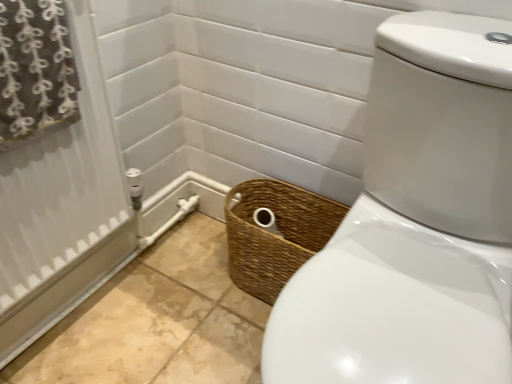
Question: Do you think woven brown basket at lower center is within brown textured fabric at upper left, or outside of it?

Choices:
 (A) inside
 (B) outside

Answer: (B)

Question: Is woven brown basket at lower center in front of or behind brown textured fabric at upper left in the image?

Choices:
 (A) behind
 (B) front

Answer: (A)

Question: Is woven brown basket at lower center wider or thinner than brown textured fabric at upper left?

Choices:
 (A) wide
 (B) thin

Answer: (A)

Question: Considering the positions of point (17, 34) and point (300, 228), is point (17, 34) closer or farther from the camera than point (300, 228)?

Choices:
 (A) closer
 (B) farther

Answer: (A)

Question: In terms of size, does brown textured fabric at upper left appear bigger or smaller than woven brown basket at lower center?

Choices:
 (A) small
 (B) big

Answer: (A)

Question: Relative to woven brown basket at lower center, is brown textured fabric at upper left in front or behind?

Choices:
 (A) front
 (B) behind

Answer: (A)

Question: Is brown textured fabric at upper left inside or outside of woven brown basket at lower center?

Choices:
 (A) outside
 (B) inside

Answer: (A)